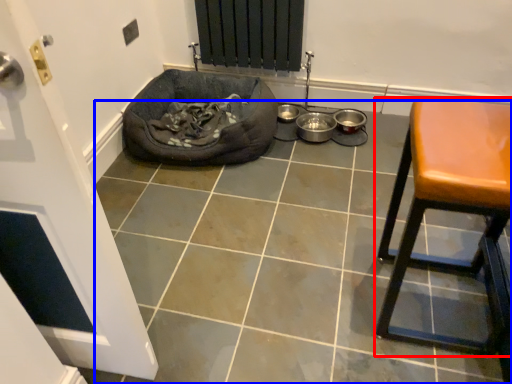
Question: Which point is further to the camera, furniture (highlighted by a red box) or tile (highlighted by a blue box)?

Choices:
 (A) furniture
 (B) tile

Answer: (B)